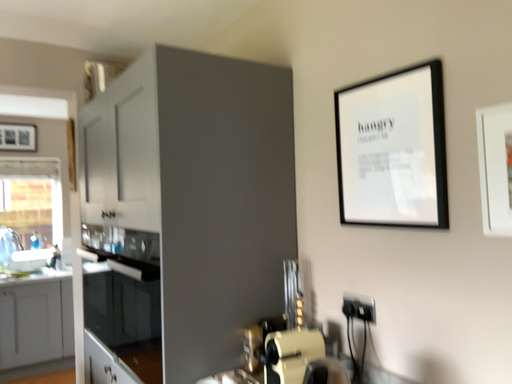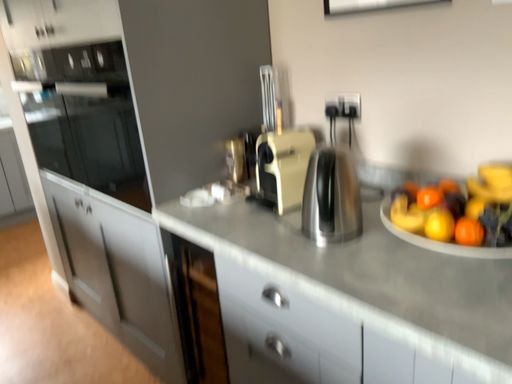
Question: Which way did the camera rotate in the video?

Choices:
 (A) rotated right
 (B) rotated left

Answer: (A)